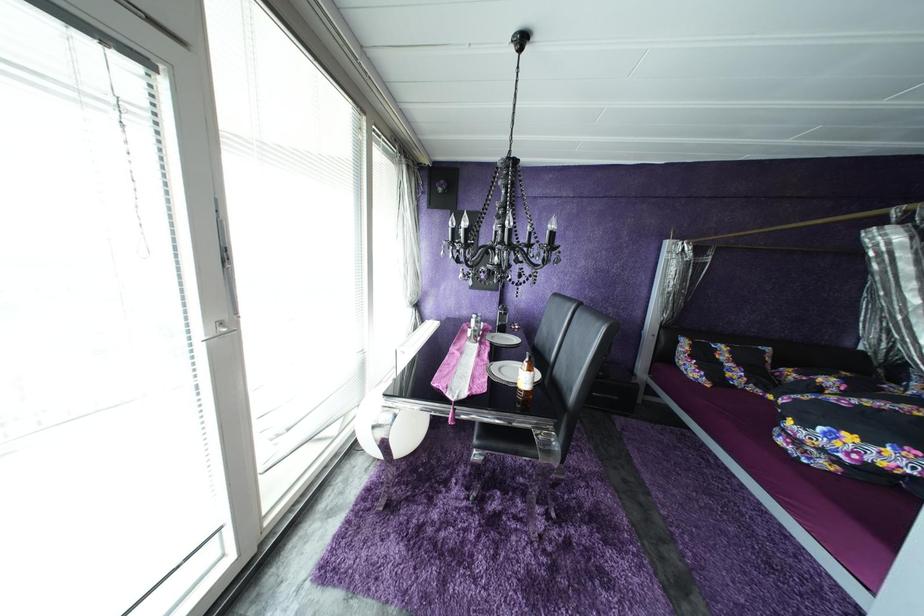
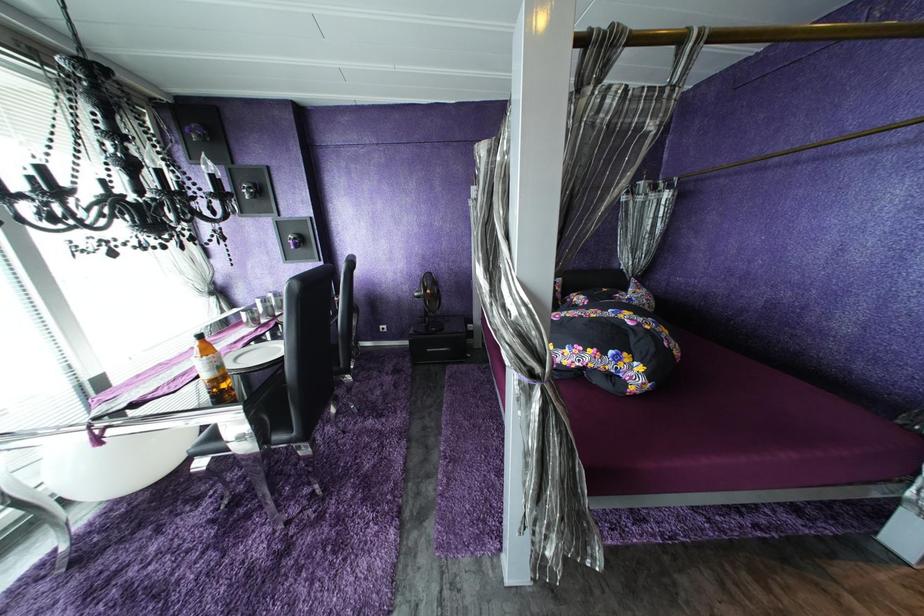
Question: What movement of the cameraman would produce the second image?

Choices:
 (A) Left
 (B) Right
 (C) Forward
 (D) Backward

Answer: (B)